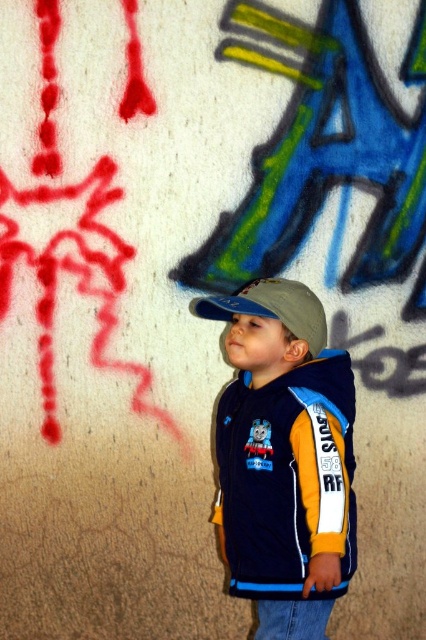
Question: Where is matte blue cap at center located in relation to matte gray baseball cap at center in the image?

Choices:
 (A) right
 (B) left

Answer: (A)

Question: Does matte blue cap at center lie behind matte gray baseball cap at center?

Choices:
 (A) yes
 (B) no

Answer: (B)

Question: Does matte blue cap at center have a greater width compared to matte gray baseball cap at center?

Choices:
 (A) yes
 (B) no

Answer: (A)

Question: Which point is farther to the camera?

Choices:
 (A) (331, 454)
 (B) (313, 317)

Answer: (B)

Question: Which object appears closest to the camera in this image?

Choices:
 (A) matte gray baseball cap at center
 (B) matte blue cap at center

Answer: (B)